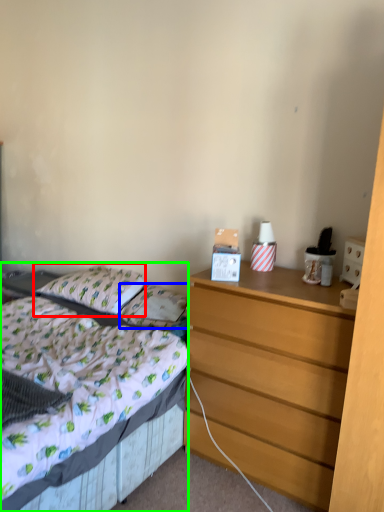
Question: Considering the real-world distances, which object is farthest from pillow (highlighted by a red box)? pillow (highlighted by a blue box) or bed (highlighted by a green box)?

Choices:
 (A) pillow
 (B) bed

Answer: (B)